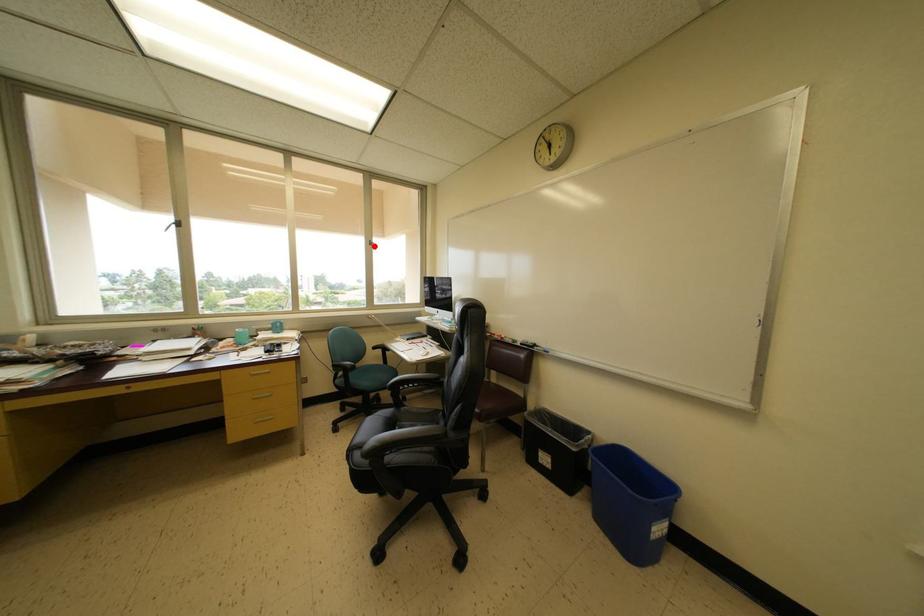
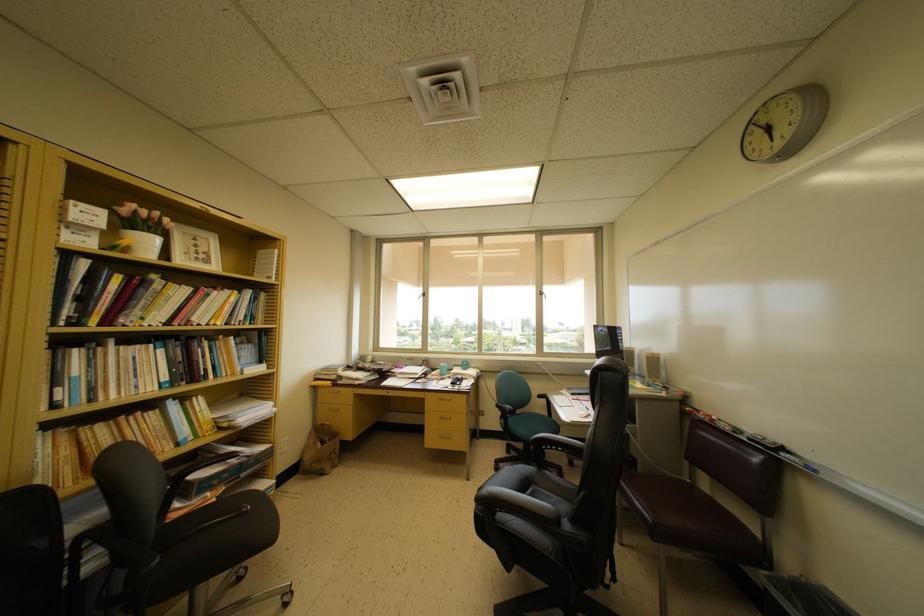
Question: I am providing you with two images of the same scene from different viewpoints. In image1, a red point is highlighted. Considering the same 3D point in image2, which of the following is correct?

Choices:
 (A) It is closer
 (B) It is farther

Answer: (A)